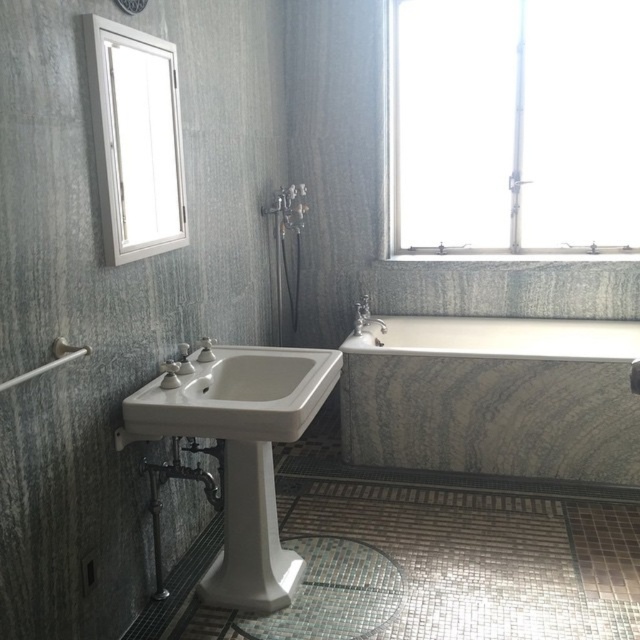
Can you confirm if transparent glass window at upper right is smaller than white porcelain sink at lower left?

No.

Can you confirm if transparent glass window at upper right is positioned below white porcelain sink at lower left?

Incorrect, transparent glass window at upper right is not positioned below white porcelain sink at lower left.

This screenshot has height=640, width=640. What are the coordinates of `transparent glass window at upper right` in the screenshot? It's located at (513, 125).

Is the position of transparent glass window at upper right more distant than that of marble bathtub at center?

Yes, it is behind marble bathtub at center.

Locate an element on the screen. This screenshot has width=640, height=640. transparent glass window at upper right is located at coordinates (513, 125).

Consider the image. Who is more forward, (573, 68) or (602, 340)?

Point (602, 340) is more forward.

The image size is (640, 640). In order to click on transparent glass window at upper right in this screenshot , I will do `click(513, 125)`.

Can you confirm if marble bathtub at center is shorter than white glossy mirror at upper left?

Yes, marble bathtub at center is shorter than white glossy mirror at upper left.

Does point (579, 337) come in front of point (147, 83)?

No.

Who is more forward, (x=404, y=435) or (x=160, y=198)?

Point (x=160, y=198) is in front.

Where is `marble bathtub at center`? The height and width of the screenshot is (640, 640). marble bathtub at center is located at coordinates (493, 397).